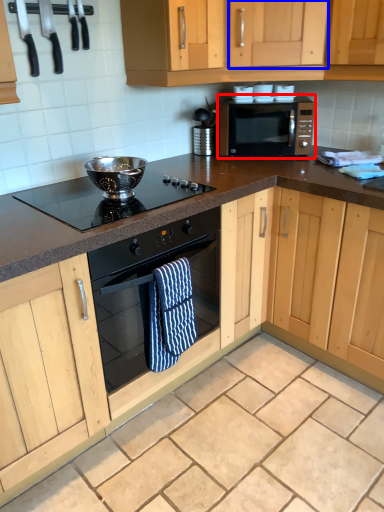
Question: Which object is further to the camera taking this photo, microwave oven (highlighted by a red box) or cabinetry (highlighted by a blue box)?

Choices:
 (A) microwave oven
 (B) cabinetry

Answer: (A)